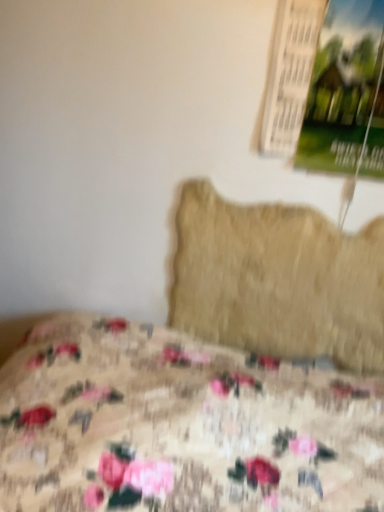
Question: Could you tell me if floral fabric bed at lower left is facing green paper poster at upper right?

Choices:
 (A) yes
 (B) no

Answer: (B)

Question: Is floral fabric bed at lower left taller than green paper poster at upper right?

Choices:
 (A) yes
 (B) no

Answer: (A)

Question: Does floral fabric bed at lower left have a larger size compared to green paper poster at upper right?

Choices:
 (A) no
 (B) yes

Answer: (B)

Question: Can you confirm if floral fabric bed at lower left is positioned to the right of green paper poster at upper right?

Choices:
 (A) yes
 (B) no

Answer: (B)

Question: Does floral fabric bed at lower left have a lesser width compared to green paper poster at upper right?

Choices:
 (A) yes
 (B) no

Answer: (B)

Question: Does floral fabric bed at lower left have a greater width compared to green paper poster at upper right?

Choices:
 (A) no
 (B) yes

Answer: (B)

Question: From a real-world perspective, does beige fuzzy pillow at center sit lower than green paper poster at upper right?

Choices:
 (A) no
 (B) yes

Answer: (B)

Question: From the image's perspective, does beige fuzzy pillow at center appear lower than green paper poster at upper right?

Choices:
 (A) yes
 (B) no

Answer: (A)

Question: From a real-world perspective, is beige fuzzy pillow at center positioned over green paper poster at upper right based on gravity?

Choices:
 (A) yes
 (B) no

Answer: (B)

Question: Does beige fuzzy pillow at center have a smaller size compared to green paper poster at upper right?

Choices:
 (A) no
 (B) yes

Answer: (A)

Question: Is beige fuzzy pillow at center wider than green paper poster at upper right?

Choices:
 (A) no
 (B) yes

Answer: (A)

Question: Are beige fuzzy pillow at center and green paper poster at upper right far apart?

Choices:
 (A) yes
 (B) no

Answer: (B)

Question: Can you confirm if green paper poster at upper right is positioned to the right of floral fabric bed at lower left?

Choices:
 (A) no
 (B) yes

Answer: (B)